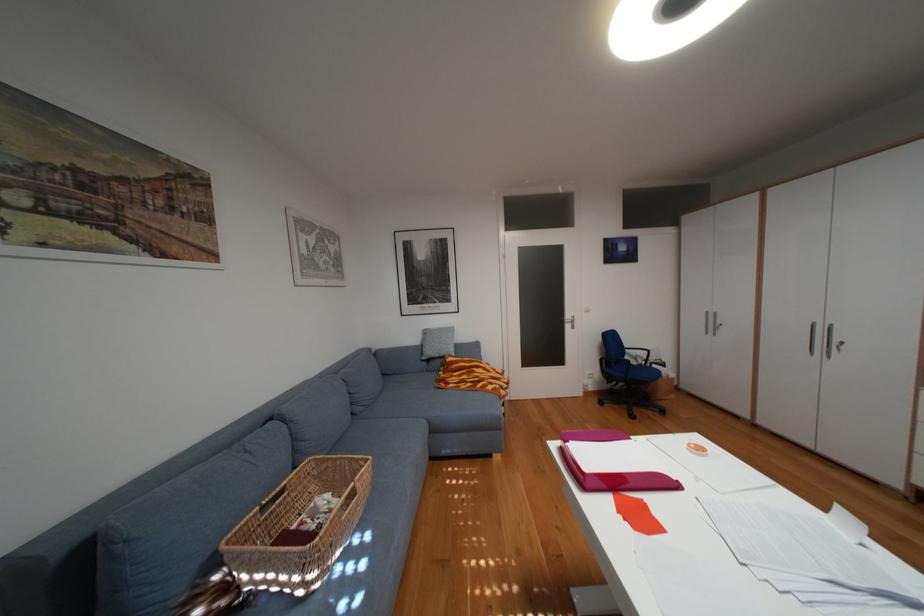
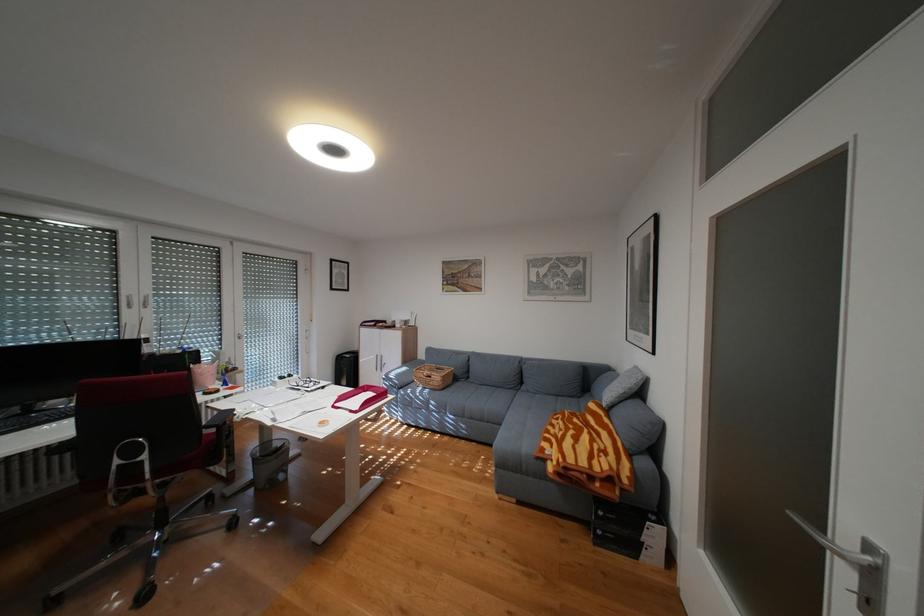
Where in the second image is the point corresponding to point (504, 383) from the first image?

(564, 445)